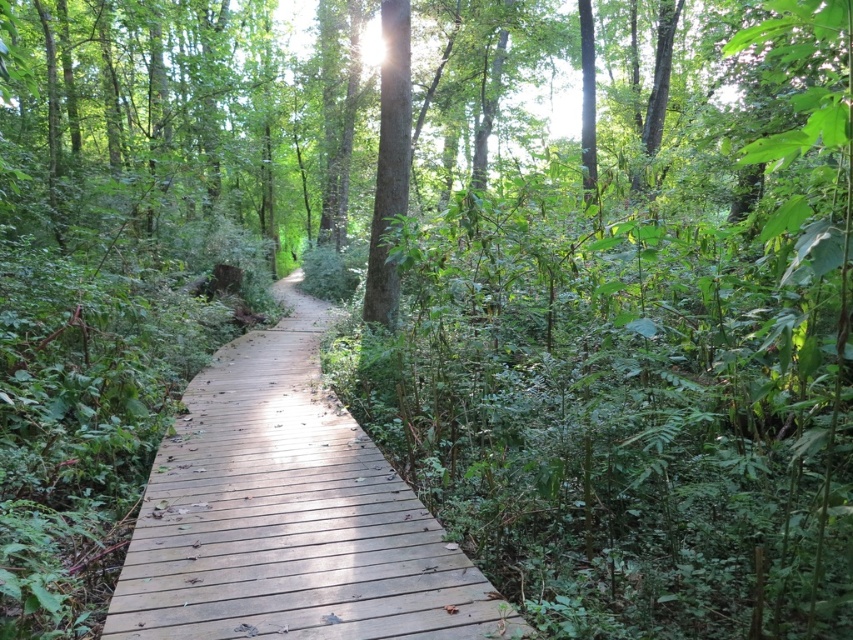
You are a hiker walking along the wooden boardwalk in the forest. You notice the wooden at center and the green matte tree at center. Which object is positioned to the left when facing the direction of the boardwalk?

The wooden at center is positioned to the left of the green matte tree at center when facing the direction of the boardwalk.

You are standing at the point marked as point [288,515] in the forest scene. What object is exactly at this coordinate?

The wooden boardwalk pathway is located at point [288,515].